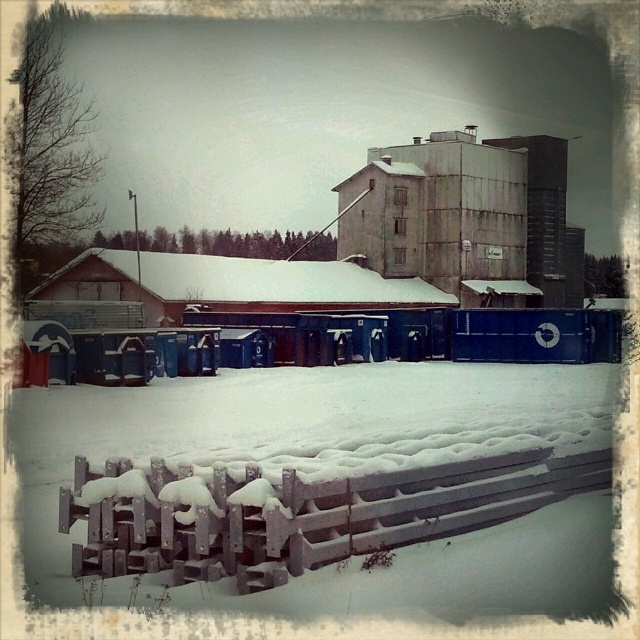
You are standing at the point marked by the coordinate point at (x=310, y=515) in the image. What object are you immediately facing?

The point at (x=310, y=515) marks the wooden snow covered fence at lower center, so you are immediately facing the wooden snow covered fence at lower center.